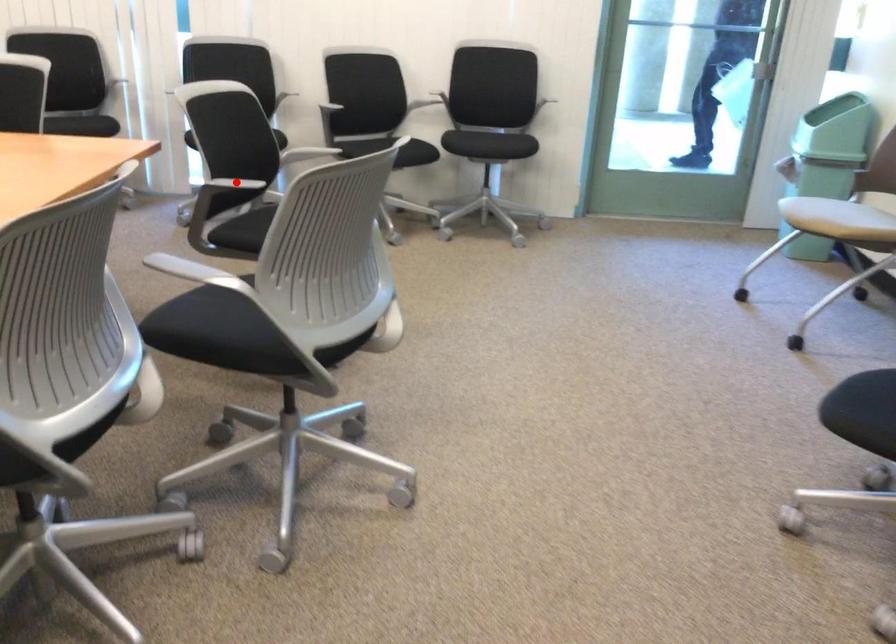
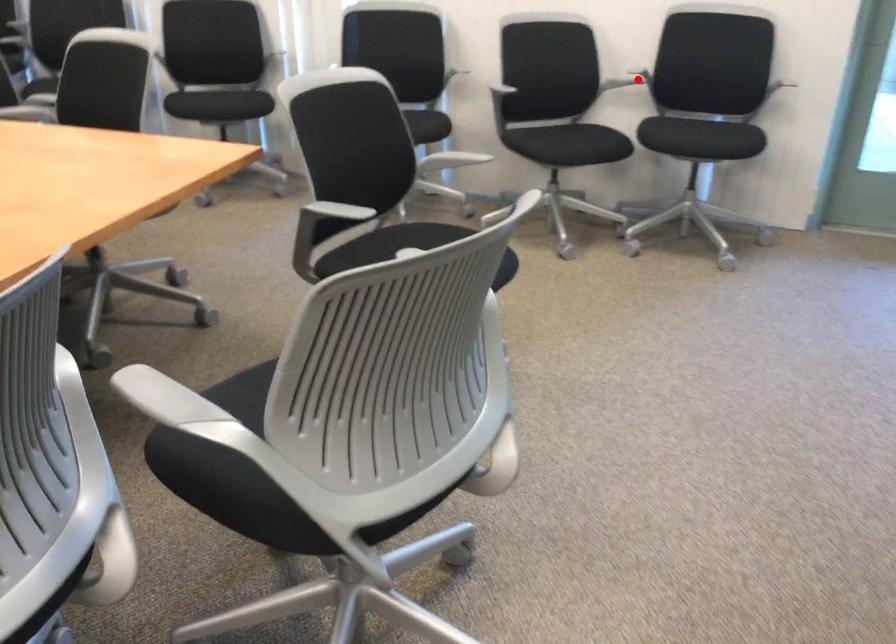
I am providing you with two images of the same scene from different viewpoints. A red point is marked on the first image and another point is marked on the second image. Do the highlighted points in image1 and image2 indicate the same real-world spot?

No